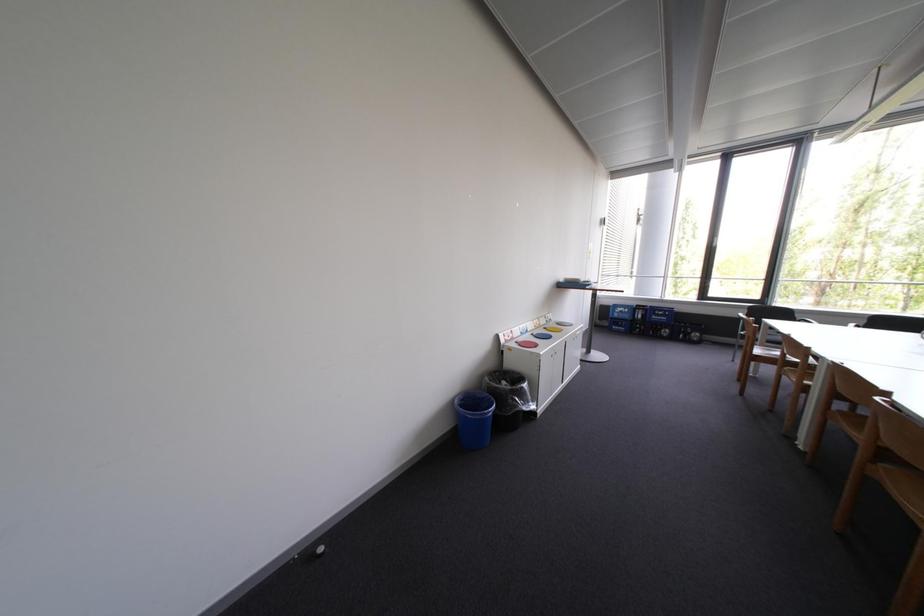
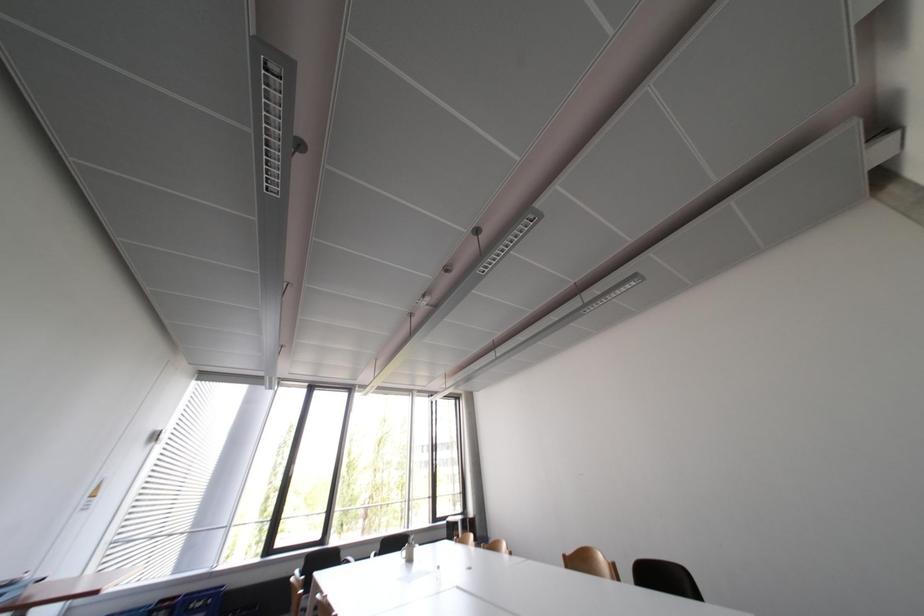
How did the camera likely rotate?

The camera rotated toward right-up.